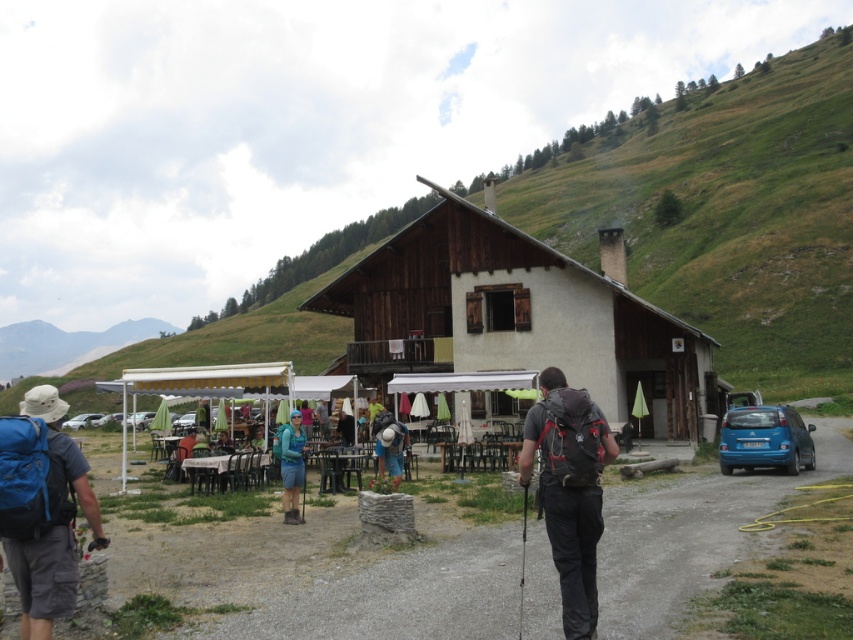
You are standing at the base of the mountain looking at the wooden cabin at center and the blue fabric backpack at left. Which object is higher in elevation?

The wooden cabin at center is above the blue fabric backpack at left, so it is higher in elevation.

You are standing at the entrance of the rustic wooden chalet and want to place a new decorative item. Where should you place the blue fabric backpack at left to match the existing scene?

The blue fabric backpack at left should be placed at the 2D location point [51,524] to match the existing scene.

You are standing at the point labeled point (363, 260) and want to walk to the point labeled point (91, 424). Based on the scene description, which direction should you move to reach your destination?

You should move backward because point (363, 260) is in front of point (91, 424), meaning the destination is behind your current position.